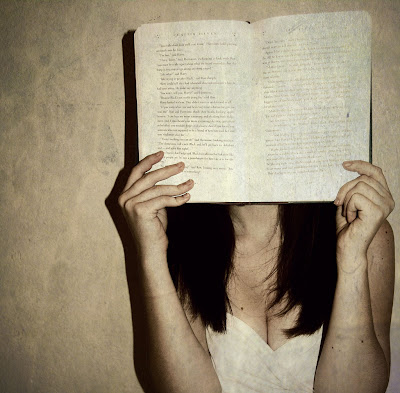
Identify the location of book. (227, 154).